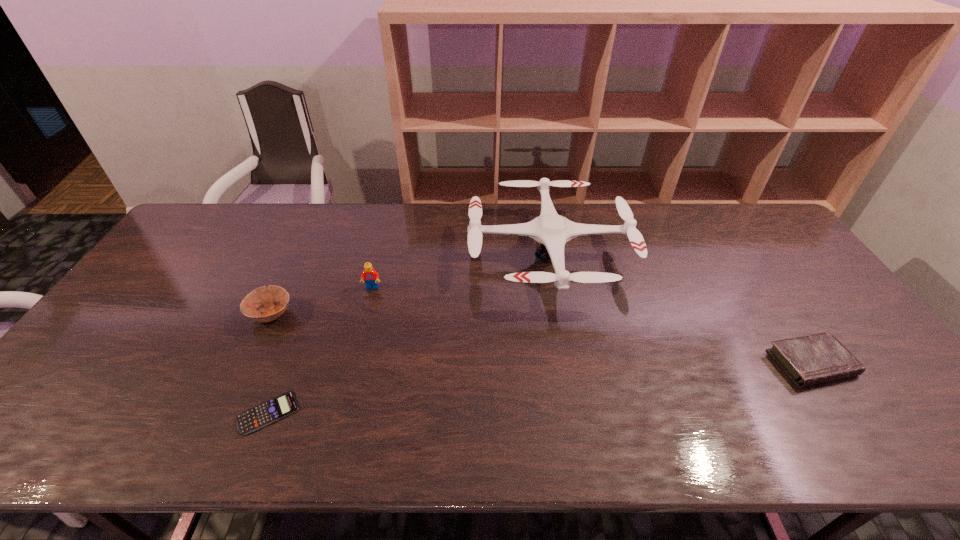
I want to click on drone, so click(553, 231).

At what (x,y) coordinates should I click in order to perform the action: click on the tallest object. Please return your answer as a coordinate pair (x, y). Looking at the image, I should click on (553, 231).

Locate an element on the screen. the third object from left to right is located at coordinates (371, 277).

Find the location of a particular element. the second tallest object is located at coordinates (371, 277).

This screenshot has height=540, width=960. I want to click on bowl, so click(268, 296).

The width and height of the screenshot is (960, 540). What are the coordinates of `the rightmost object` in the screenshot? It's located at (817, 358).

Identify the location of the fourth farthest object. The image size is (960, 540). (817, 358).

At what (x,y) coordinates should I click in order to perform the action: click on the shortest object. Please return your answer as a coordinate pair (x, y). Looking at the image, I should click on (270, 411).

The height and width of the screenshot is (540, 960). Find the location of `calculator`. calculator is located at coordinates (270, 411).

Image resolution: width=960 pixels, height=540 pixels. Find the location of `vacant space situated with the camera attached at the bottom of the drone`. vacant space situated with the camera attached at the bottom of the drone is located at coordinates (570, 378).